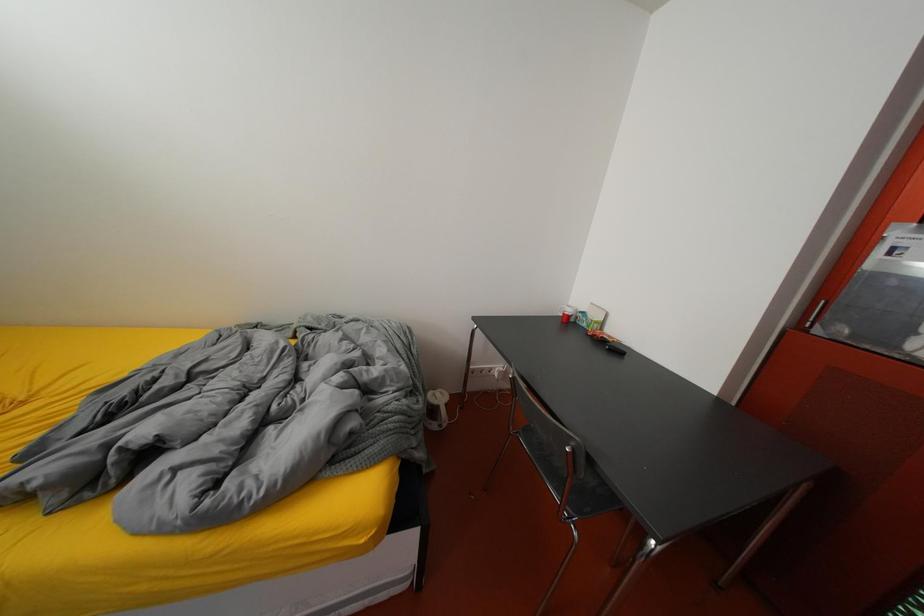
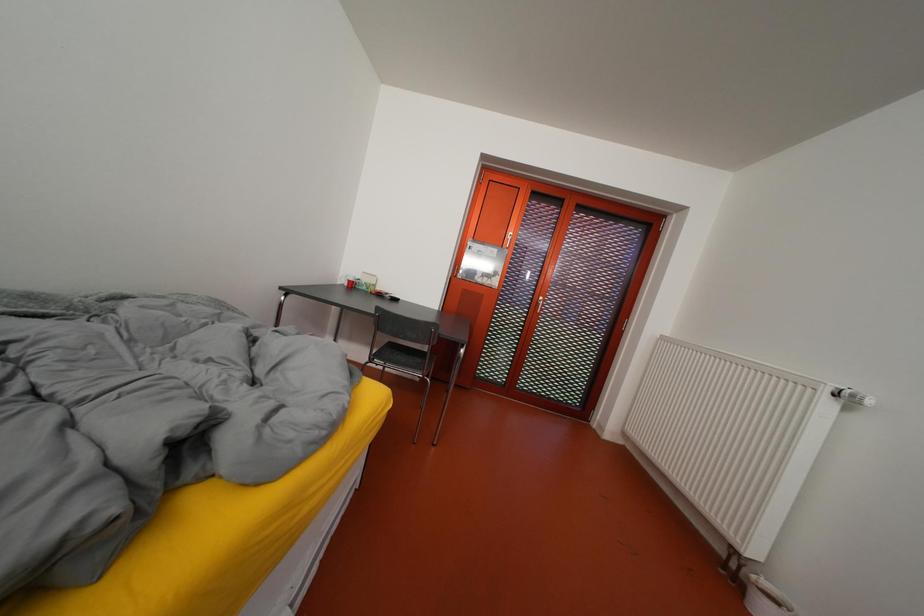
Question: The camera is either moving clockwise (left) or counter-clockwise (right) around the object. The first image is from the beginning of the video and the second image is from the end. Is the camera moving left or right when shooting the video?

Choices:
 (A) Left
 (B) Right

Answer: (A)